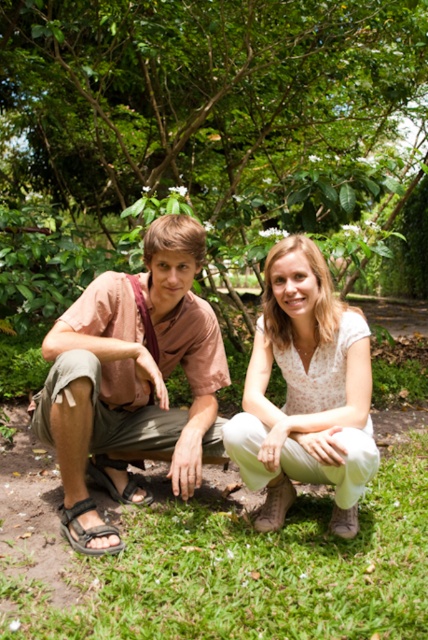
Is white floral blouse at center wider than black fabric sandal at lower left?

Indeed, white floral blouse at center has a greater width compared to black fabric sandal at lower left.

In the scene shown: Who is more forward, (300, 371) or (79, 541)?

Point (79, 541)

Where is `white floral blouse at center`? white floral blouse at center is located at coordinates (306, 392).

Between green grass at lower center and light brown cotton shirt at left, which one appears on the right side from the viewer's perspective?

green grass at lower center is more to the right.

Where is `green grass at lower center`? green grass at lower center is located at coordinates (250, 572).

You are a GUI agent. You are given a task and a screenshot of the screen. Output one action in this format:
    pyautogui.click(x=<x>, y=<y>)
    Task: Click on the green grass at lower center
    The width and height of the screenshot is (428, 640).
    Given the screenshot: What is the action you would take?
    pyautogui.click(x=250, y=572)

Locate an element on the screen. Image resolution: width=428 pixels, height=640 pixels. green grass at lower center is located at coordinates (250, 572).

Is green leafy tree at center smaller than brown leather sandal at lower left?

Incorrect, green leafy tree at center is not smaller in size than brown leather sandal at lower left.

Who is lower down, green leafy tree at center or brown leather sandal at lower left?

brown leather sandal at lower left

Between point (419, 97) and point (118, 500), which one is positioned behind?

Point (419, 97)

Locate an element on the screen. This screenshot has width=428, height=640. green leafy tree at center is located at coordinates 205,134.